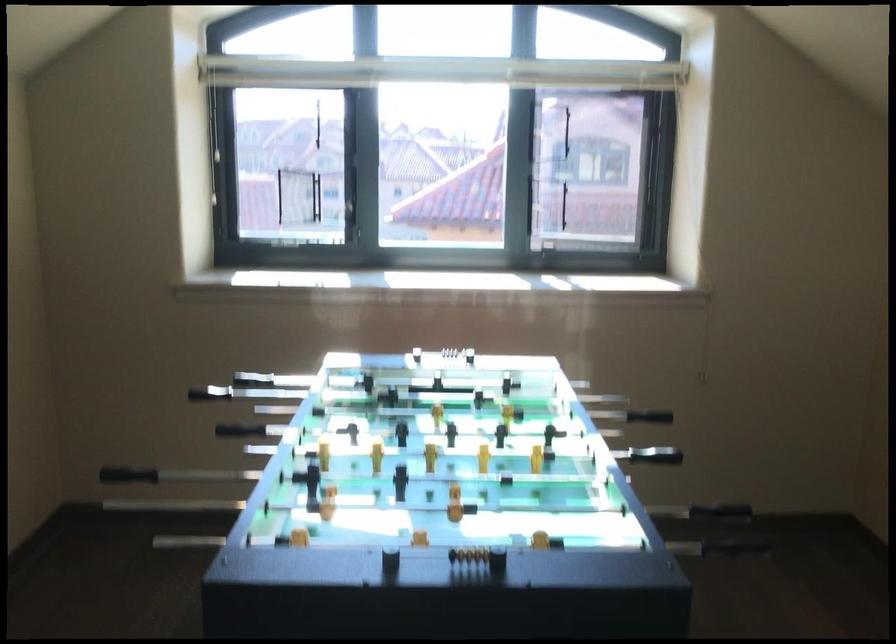
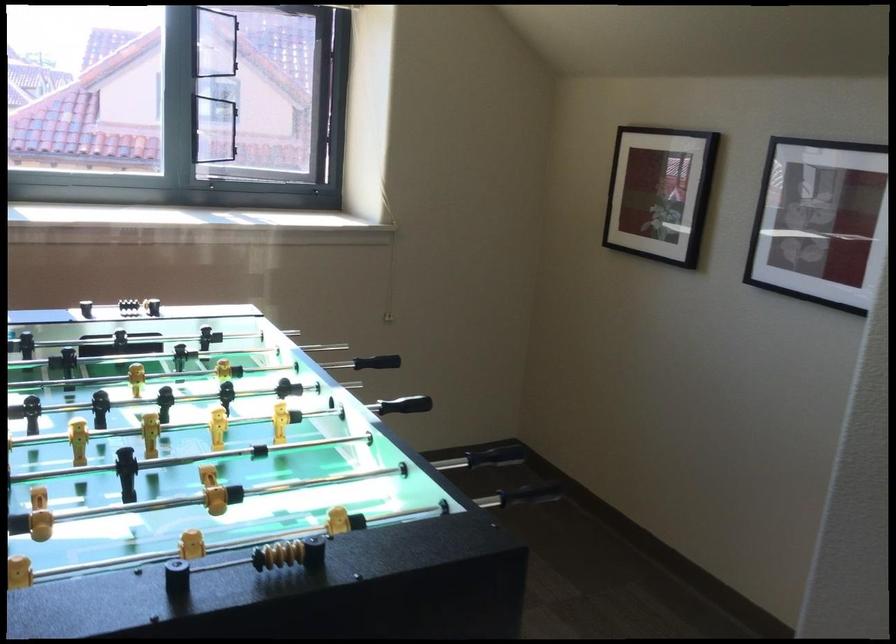
In the second image, find the point that corresponds to (736,553) in the first image.

(531, 493)